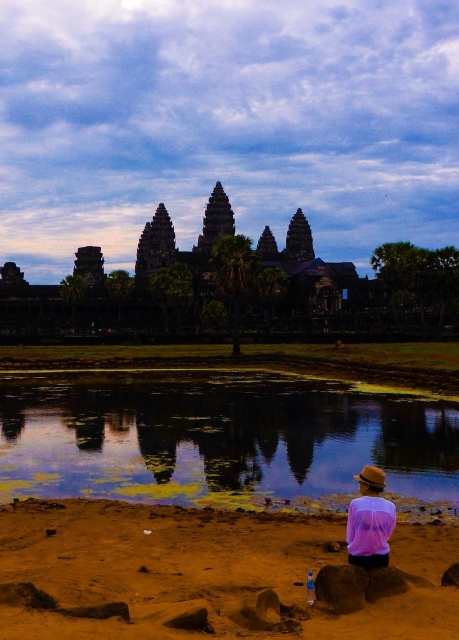
Which of these two, green algae water at lower center or pink sheer blouse at lower right, stands shorter?

pink sheer blouse at lower right

Does point (31, 435) lie behind point (352, 552)?

Yes, point (31, 435) is farther from viewer.

This screenshot has width=459, height=640. I want to click on green algae water at lower center, so 223,442.

Is the position of pink sheer blouse at lower right more distant than that of smooth brown rock at lower center?

Yes, it is.

Can you confirm if pink sheer blouse at lower right is positioned below smooth brown rock at lower center?

No.

Does point (354, 548) come closer to viewer compared to point (330, 602)?

No, (354, 548) is further to viewer.

You are a GUI agent. You are given a task and a screenshot of the screen. Output one action in this format:
    pyautogui.click(x=<x>, y=<y>)
    Task: Click on the pink sheer blouse at lower right
    This screenshot has height=640, width=459.
    Given the screenshot: What is the action you would take?
    pyautogui.click(x=369, y=522)

Does brown sandy beach at lower right appear on the right side of smooth brown rock at lower center?

Incorrect, brown sandy beach at lower right is not on the right side of smooth brown rock at lower center.

Is brown sandy beach at lower right smaller than smooth brown rock at lower center?

Incorrect, brown sandy beach at lower right is not smaller in size than smooth brown rock at lower center.

Does point (130, 600) come in front of point (339, 570)?

Yes.

Locate an element on the screen. This screenshot has height=640, width=459. brown sandy beach at lower right is located at coordinates (203, 573).